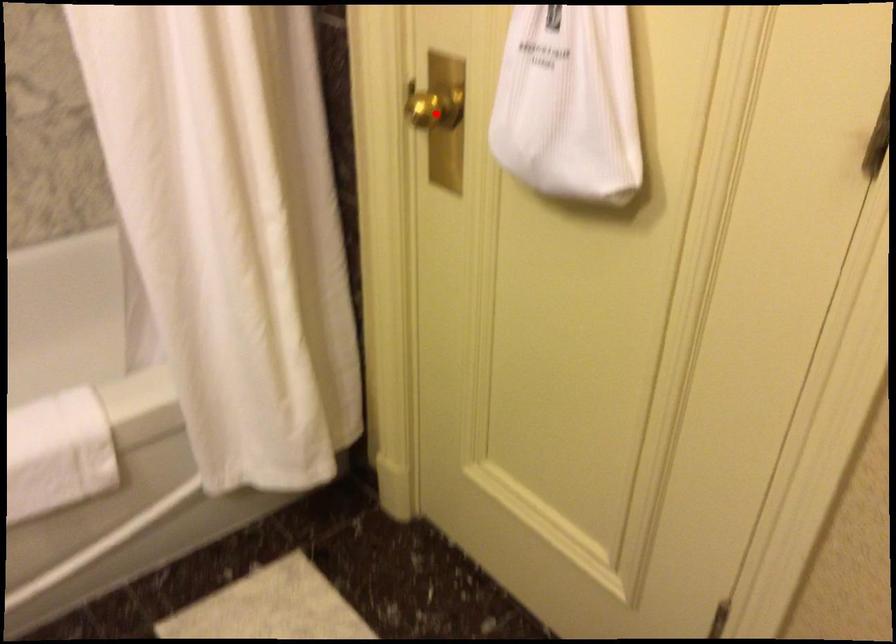
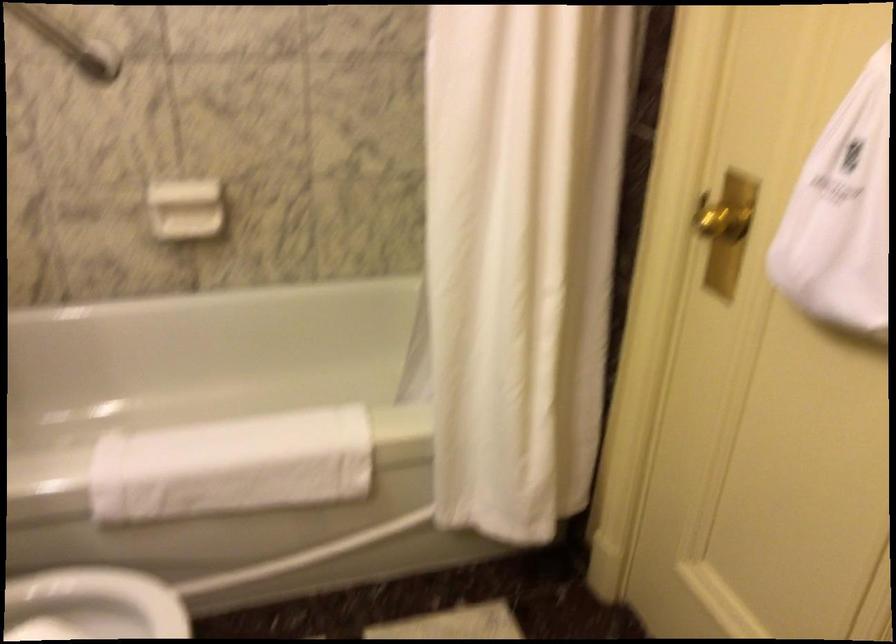
Find the pixel in the second image that matches the highlighted location in the first image.

(722, 222)